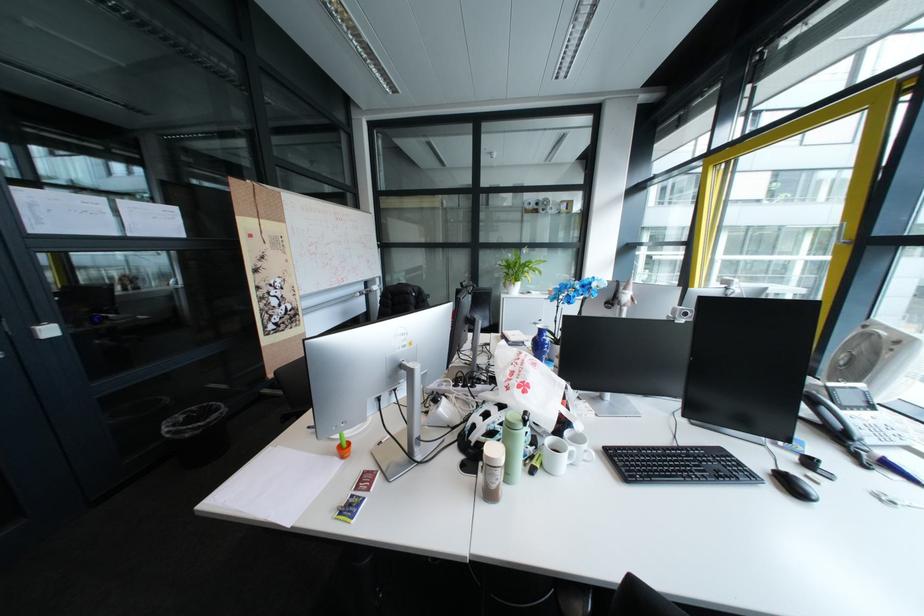
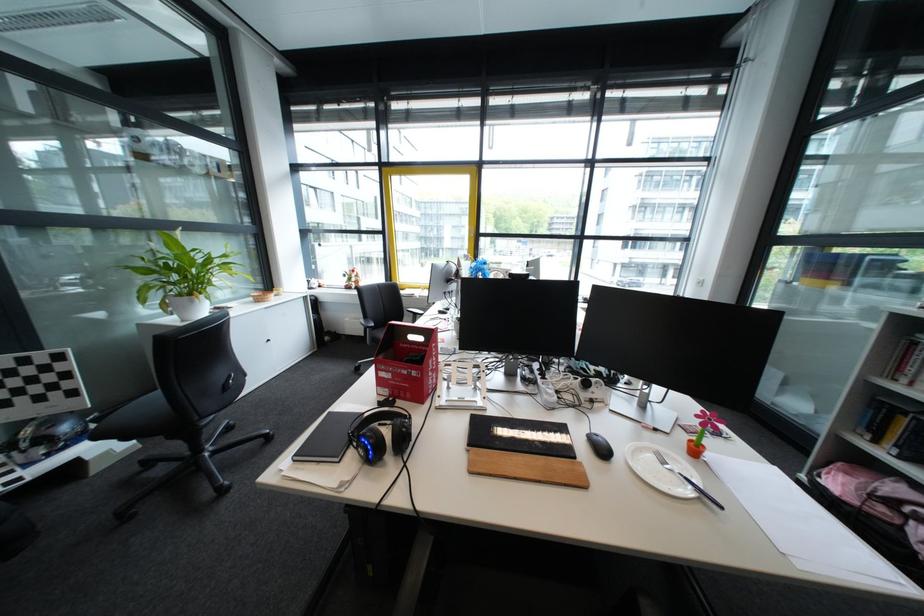
Question: I am providing you with two images of the same scene from different viewpoints. After the viewpoint changes to image2, which objects are now occluded?

Choices:
 (A) white flower pot
 (B) silver fork
 (C) black computer mouse
 (D) blue bicycle seat

Answer: (C)